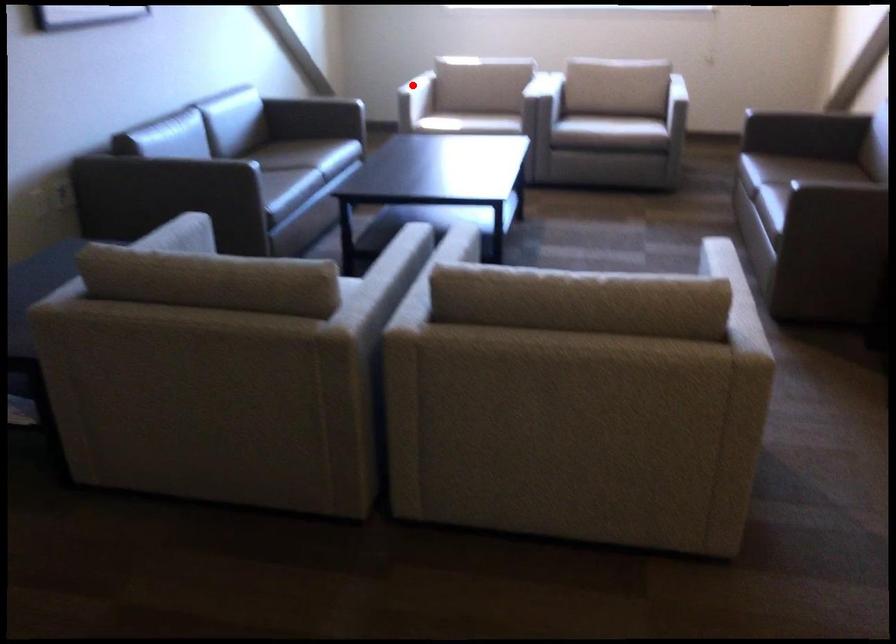
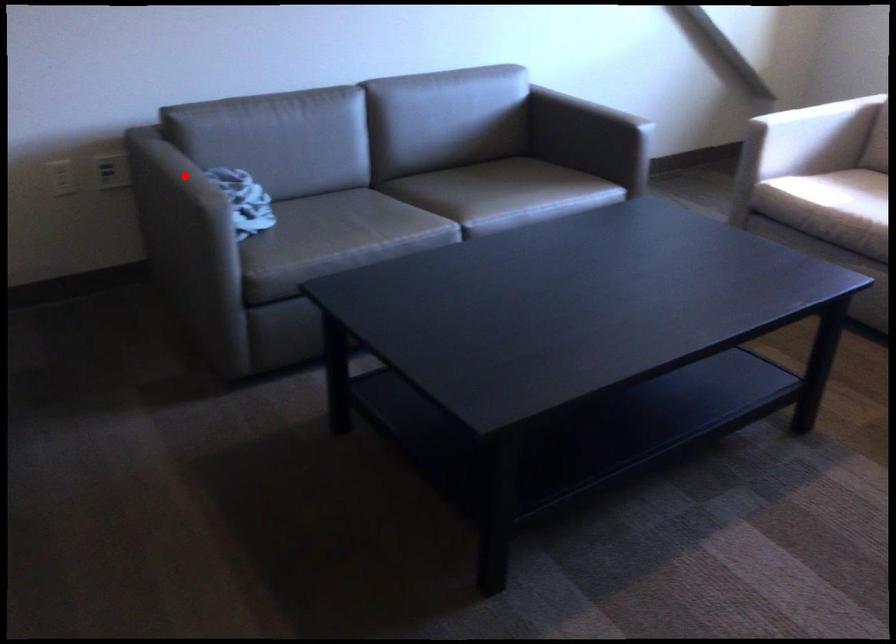
I am providing you with two images of the same scene from different viewpoints. A red point is marked on the first image and another point is marked on the second image. Do the highlighted points in image1 and image2 indicate the same real-world spot?

No